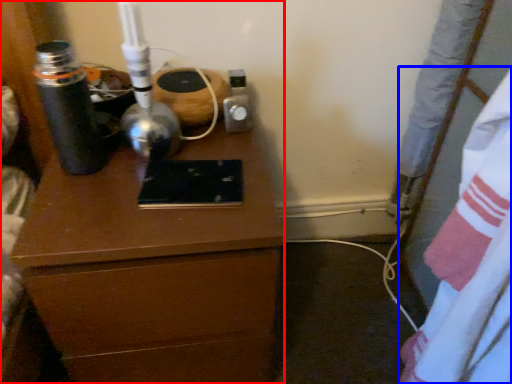
Question: Which object appears closest to the camera in this image, chest of drawers (highlighted by a red box) or sheet (highlighted by a blue box)?

Choices:
 (A) chest of drawers
 (B) sheet

Answer: (B)